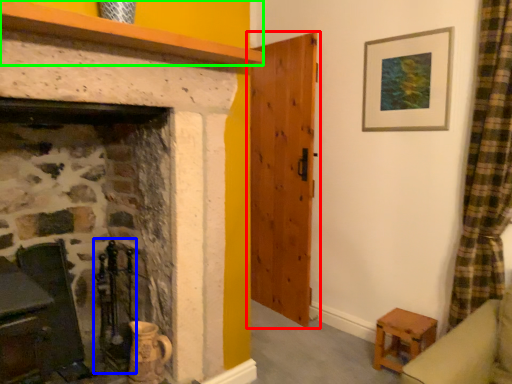
Question: Which is nearer to the door (highlighted by a red box)? chair (highlighted by a blue box) or mantle (highlighted by a green box).

Choices:
 (A) chair
 (B) mantle

Answer: (A)